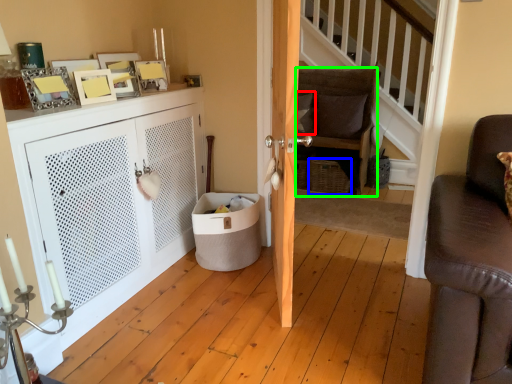
Question: Which object is positioned farthest from pillow (highlighted by a red box)? Select from basket (highlighted by a blue box) and chair (highlighted by a green box).

Choices:
 (A) basket
 (B) chair

Answer: (A)